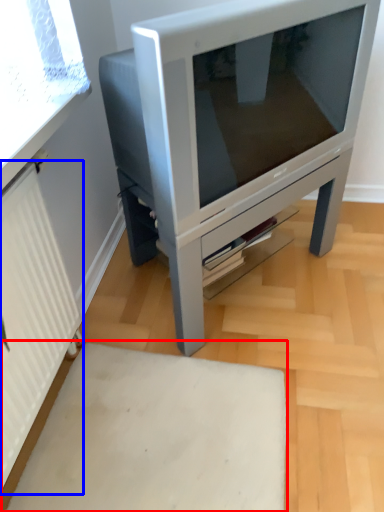
Question: Which object is further to the camera taking this photo, plain (highlighted by a red box) or radiator (highlighted by a blue box)?

Choices:
 (A) plain
 (B) radiator

Answer: (A)